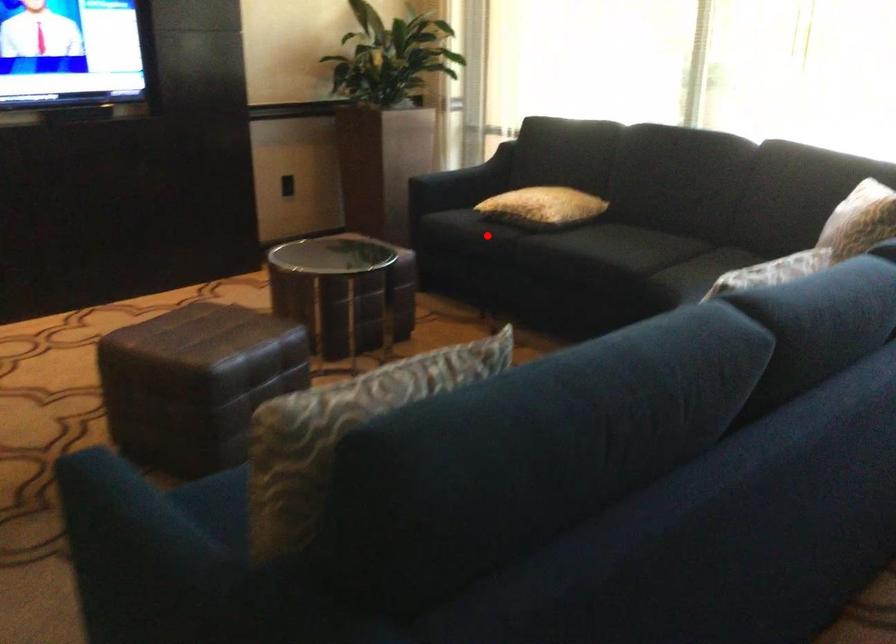
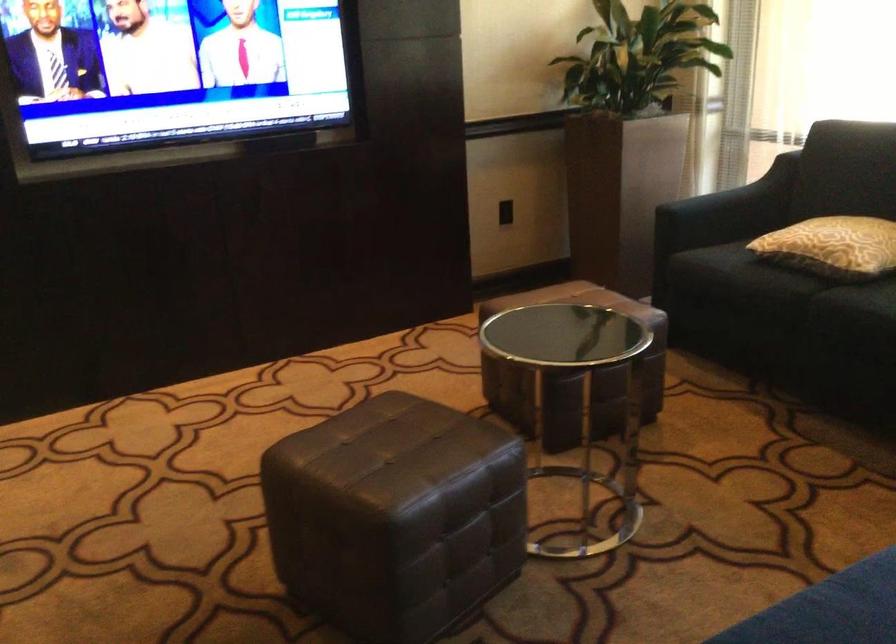
Find the pixel in the second image that matches the highlighted location in the first image.

(767, 283)